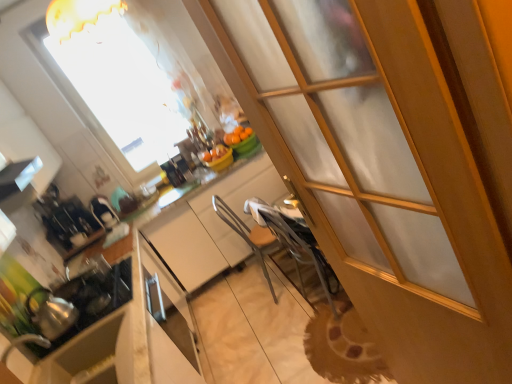
What do you see at coordinates (115, 90) in the screenshot?
I see `transparent glass window at upper center` at bounding box center [115, 90].

In order to click on white glossy counter at center in this screenshot , I will do `click(117, 333)`.

Measure the distance between point (x=285, y=21) and camera.

1.21 meters.

Describe the element at coordinates (346, 143) in the screenshot. This screenshot has width=512, height=384. I see `transparent glass screen door at center` at that location.

Locate an element on the screen. The width and height of the screenshot is (512, 384). transparent glass window at upper center is located at coordinates (115, 90).

Is shiny metallic kettle at left, placed as the 3th appliance when sorted from back to front, positioned far away from transparent glass window at upper center?

Yes, shiny metallic kettle at left, placed as the 3th appliance when sorted from back to front, and transparent glass window at upper center are located far from each other.

Considering the relative positions of shiny metallic kettle at left, placed as the 3th appliance when sorted from back to front, and transparent glass window at upper center in the image provided, is shiny metallic kettle at left, placed as the 3th appliance when sorted from back to front, behind transparent glass window at upper center?

No.

Between shiny metallic kettle at left, marked as the first appliance in a front-to-back arrangement, and transparent glass window at upper center, which one has larger size?

transparent glass window at upper center is bigger.

Consider the image. Is shiny metallic kettle at left, placed as the 3th appliance when sorted from back to front, not inside transparent glass window at upper center?

shiny metallic kettle at left, placed as the 3th appliance when sorted from back to front, is positioned outside transparent glass window at upper center.

Is metallic silver chair at center far from matte white cabinet at center?

metallic silver chair at center is actually quite close to matte white cabinet at center.

From the image's perspective, is metallic silver chair at center beneath matte white cabinet at center?

Indeed, from the image's perspective, metallic silver chair at center is shown beneath matte white cabinet at center.

Is metallic silver chair at center positioned with its back to matte white cabinet at center?

That's not correct — metallic silver chair at center is not looking away from matte white cabinet at center.

Is metallic silver chair at center situated inside matte white cabinet at center or outside?

metallic silver chair at center is not enclosed by matte white cabinet at center.

Considering the positions of objects transparent glass screen door at center and white glossy exhaust hood at upper left in the image provided, who is more to the right, transparent glass screen door at center or white glossy exhaust hood at upper left?

Positioned to the right is transparent glass screen door at center.

From a real-world perspective, does transparent glass screen door at center sit lower than white glossy exhaust hood at upper left?

Indeed, from a real-world perspective, transparent glass screen door at center is positioned beneath white glossy exhaust hood at upper left.

Is transparent glass screen door at center thinner than white glossy exhaust hood at upper left?

Yes.

Is transparent glass screen door at center positioned with its back to white glossy exhaust hood at upper left?

No, white glossy exhaust hood at upper left is not at the back of transparent glass screen door at center.

Considering the relative sizes of satin black iron at center, marked as the 1th appliance in a back-to-front arrangement, and transparent glass window at upper center in the image provided, is satin black iron at center, marked as the 1th appliance in a back-to-front arrangement, wider than transparent glass window at upper center?

Correct, the width of satin black iron at center, marked as the 1th appliance in a back-to-front arrangement, exceeds that of transparent glass window at upper center.

Would you say satin black iron at center, marked as the 1th appliance in a back-to-front arrangement, is inside or outside transparent glass window at upper center?

satin black iron at center, marked as the 1th appliance in a back-to-front arrangement, is spatially situated outside transparent glass window at upper center.

How distant is satin black iron at center, the 3th appliance from the front, from transparent glass window at upper center?

satin black iron at center, the 3th appliance from the front, is 35.50 inches from transparent glass window at upper center.

From a real-world perspective, is satin black iron at center, the 3th appliance from the front, on transparent glass window at upper center?

No.

Which object is wider, satin black coffee maker at left, placed as the second appliance when sorted from back to front, or shiny silver tea pot at lower left?

With larger width is satin black coffee maker at left, placed as the second appliance when sorted from back to front.

From a real-world perspective, between satin black coffee maker at left, placed as the second appliance when sorted from back to front, and shiny silver tea pot at lower left, who is vertically higher?

satin black coffee maker at left, placed as the second appliance when sorted from back to front, is physically above.

There is a shiny silver tea pot at lower left. Identify the location of the 1st appliance above it (from the image's perspective). (64, 219).

Which of these two, satin black coffee maker at left, placed as the second appliance when sorted from back to front, or shiny silver tea pot at lower left, is smaller?

With smaller size is shiny silver tea pot at lower left.

From the image's perspective, which one is positioned higher, shiny metallic kettle at left, marked as the first appliance in a front-to-back arrangement, or metallic silver chair at center?

metallic silver chair at center, from the image's perspective.

Is shiny metallic kettle at left, marked as the first appliance in a front-to-back arrangement, wider or thinner than metallic silver chair at center?

Clearly, shiny metallic kettle at left, marked as the first appliance in a front-to-back arrangement, has more width compared to metallic silver chair at center.

Is point (74, 278) positioned in front of point (269, 280)?

Yes, point (74, 278) is in front of point (269, 280).

From a real-world perspective, is shiny metallic kettle at left, marked as the first appliance in a front-to-back arrangement, over metallic silver chair at center?

Yes, from a real-world perspective, shiny metallic kettle at left, marked as the first appliance in a front-to-back arrangement, is on top of metallic silver chair at center.

Is white glossy counter at center next to transparent glass screen door at center and touching it?

No, white glossy counter at center is not beside transparent glass screen door at center.

Considering the relative sizes of white glossy counter at center and transparent glass screen door at center in the image provided, is white glossy counter at center smaller than transparent glass screen door at center?

Incorrect, white glossy counter at center is not smaller in size than transparent glass screen door at center.

Consider the image. From the image's perspective, is white glossy counter at center on transparent glass screen door at center?

No, from the image's perspective, white glossy counter at center is not above transparent glass screen door at center.

In terms of height, does white glossy counter at center look taller or shorter compared to transparent glass screen door at center?

Clearly, white glossy counter at center is shorter compared to transparent glass screen door at center.

You are a GUI agent. You are given a task and a screenshot of the screen. Output one action in this format:
    pyautogui.click(x=<x>, y=<y>)
    Task: Click on the 3rd appliance positioned below the transparent glass window at upper center (from a real-world perspective)
    The image size is (512, 384).
    Given the screenshot: What is the action you would take?
    pyautogui.click(x=90, y=300)

Where is `cabinetry above the metallic silver chair at center (from a real-world perspective)`? cabinetry above the metallic silver chair at center (from a real-world perspective) is located at coordinates (211, 224).

Considering their positions, is white glossy exhaust hood at upper left positioned closer to transparent glass screen door at center than orange matte bowl at center?

Among the two, orange matte bowl at center is located nearer to transparent glass screen door at center.

Based on the photo, when comparing their distances from orange matte bowl at center, does transparent glass screen door at center or satin black iron at center, the 3th appliance from the front, seem further?

The object further to orange matte bowl at center is transparent glass screen door at center.

Based on their spatial positions, is white glossy exhaust hood at upper left or shiny metallic kettle at left, marked as the first appliance in a front-to-back arrangement, further from satin black iron at center, marked as the 1th appliance in a back-to-front arrangement?

Based on the image, shiny metallic kettle at left, marked as the first appliance in a front-to-back arrangement, appears to be further to satin black iron at center, marked as the 1th appliance in a back-to-front arrangement.

Which object lies nearer to the anchor point transparent glass screen door at center, metallic silver chair at center or shiny silver tea pot at lower left?

Among the two, metallic silver chair at center is located nearer to transparent glass screen door at center.

Which object lies nearer to the anchor point satin black iron at center, the 3th appliance from the front, matte white cabinet at center or shiny metallic kettle at left, marked as the first appliance in a front-to-back arrangement?

matte white cabinet at center is positioned closer to the anchor satin black iron at center, the 3th appliance from the front.

When comparing their distances from transparent glass window at upper center, does shiny metallic kettle at left, placed as the 3th appliance when sorted from back to front, or matte white cabinet at center seem further?

shiny metallic kettle at left, placed as the 3th appliance when sorted from back to front.

Based on their spatial positions, is white glossy counter at center or metallic silver chair at center further from satin black coffee maker at left, placed as the second appliance when sorted from back to front?

metallic silver chair at center.

Looking at the image, which one is located further to shiny metallic kettle at left, placed as the 3th appliance when sorted from back to front, transparent glass window at upper center or orange matte bowl at center?

transparent glass window at upper center is further to shiny metallic kettle at left, placed as the 3th appliance when sorted from back to front.

At what (x,y) coordinates should I click in order to perform the action: click on cabinetry between transparent glass window at upper center and white glossy counter at center in the vertical direction. Please return your answer as a coordinate pair (x, y). Looking at the image, I should click on (211, 224).

In order to click on fruit that lies between transparent glass window at upper center and matte white cabinet at center from top to bottom in this screenshot , I will do `click(215, 153)`.

I want to click on window located between white glossy exhaust hood at upper left and orange matte bowl at center in the depth direction, so click(x=115, y=90).

Where is `counter between satin black iron at center, the 3th appliance from the front, and orange matte bowl at center`? This screenshot has height=384, width=512. counter between satin black iron at center, the 3th appliance from the front, and orange matte bowl at center is located at coordinates (117, 333).